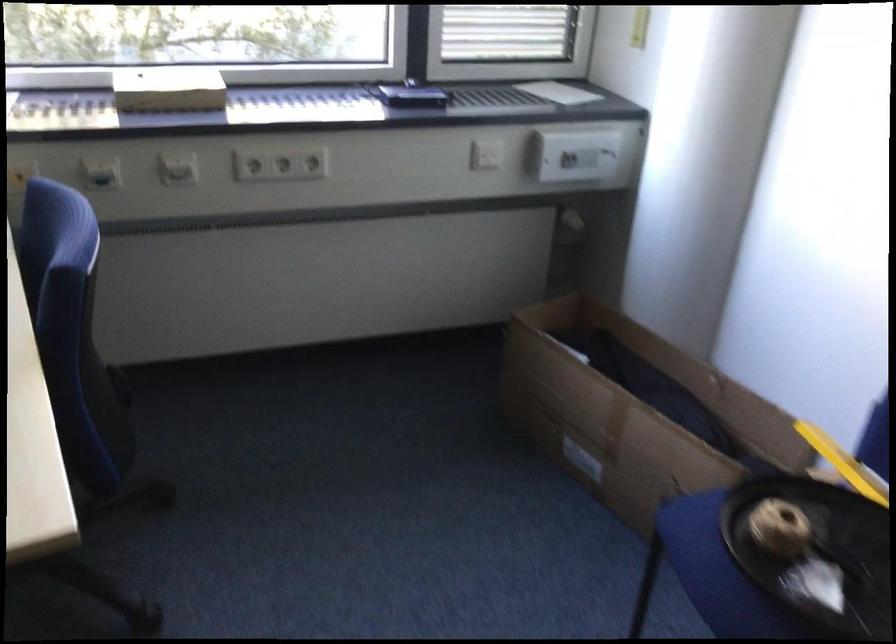
Describe the element at coordinates (177, 167) in the screenshot. I see `a safe knob` at that location.